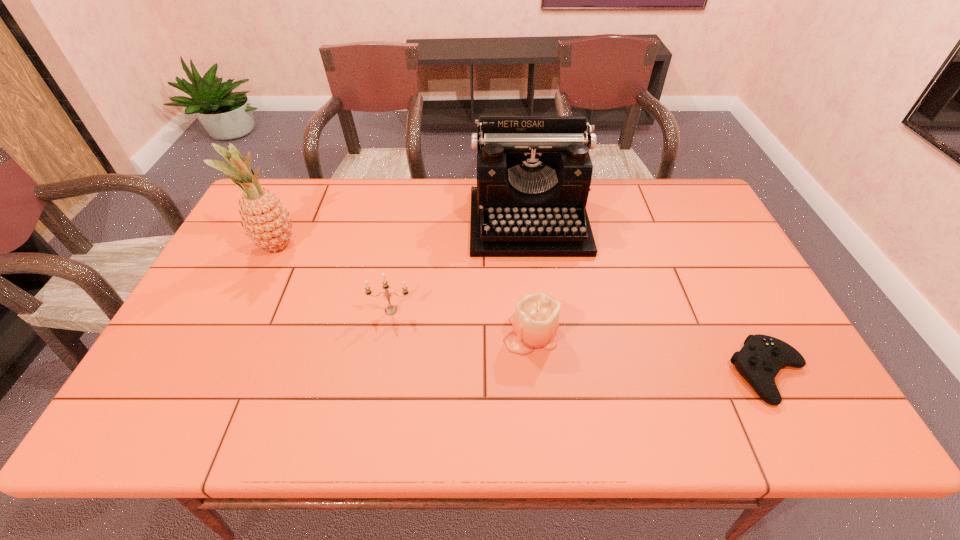
Image resolution: width=960 pixels, height=540 pixels. I want to click on free point located on the left of the second object from left to right, so click(320, 310).

This screenshot has height=540, width=960. In order to click on vacant space located 0.060m on the front of the shortest object in this screenshot , I will do `click(802, 435)`.

I want to click on object present at the far edge, so click(x=534, y=173).

Where is `object positioned at the near edge`? object positioned at the near edge is located at coordinates (761, 358).

In order to click on object at the left edge in this screenshot , I will do `click(266, 222)`.

Locate an element on the screen. This screenshot has height=540, width=960. object present at the right edge is located at coordinates (761, 358).

Locate an element on the screen. The width and height of the screenshot is (960, 540). object that is positioned at the near right corner is located at coordinates pos(761,358).

Locate an element on the screen. Image resolution: width=960 pixels, height=540 pixels. free spot at the far edge of the desktop is located at coordinates (365, 219).

In the image, there is a desktop. Where is `vacant space at the near edge`? Image resolution: width=960 pixels, height=540 pixels. vacant space at the near edge is located at coordinates (415, 434).

Where is `free region at the right edge of the desktop`? This screenshot has width=960, height=540. free region at the right edge of the desktop is located at coordinates pos(685,261).